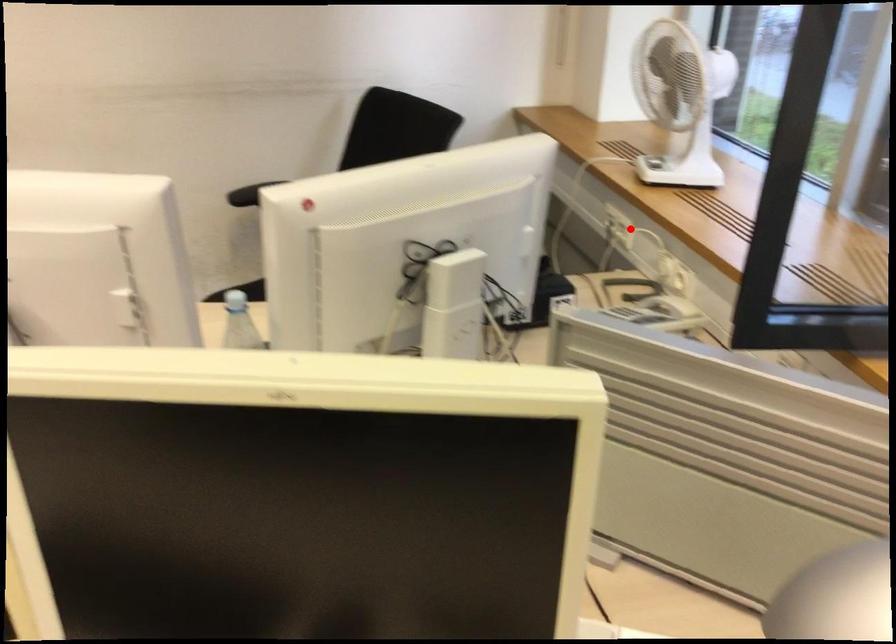
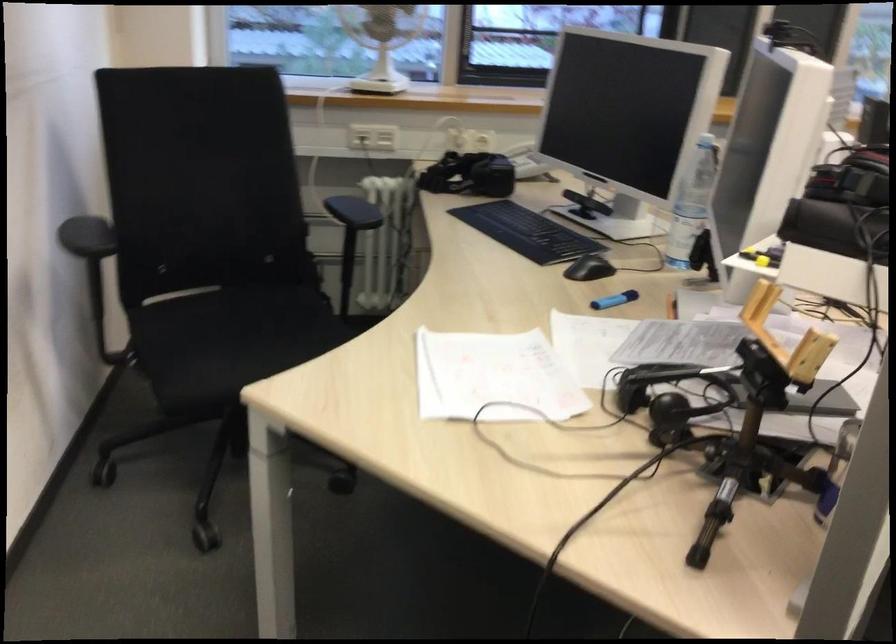
Locate, in the second image, the point that corresponds to the highlighted location in the first image.

(385, 138)